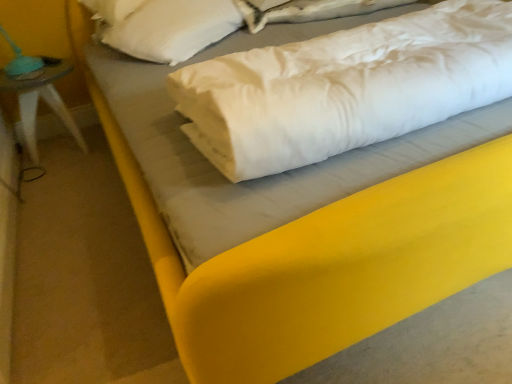
Question: Considering the relative sizes of white satin sheet at upper center and teal fabric lampshade at left in the image provided, is white satin sheet at upper center shorter than teal fabric lampshade at left?

Choices:
 (A) no
 (B) yes

Answer: (B)

Question: From a real-world perspective, is white satin sheet at upper center on teal fabric lampshade at left?

Choices:
 (A) no
 (B) yes

Answer: (B)

Question: Considering the relative sizes of white satin sheet at upper center and teal fabric lampshade at left in the image provided, is white satin sheet at upper center taller than teal fabric lampshade at left?

Choices:
 (A) no
 (B) yes

Answer: (A)

Question: Does white satin sheet at upper center have a larger size compared to teal fabric lampshade at left?

Choices:
 (A) yes
 (B) no

Answer: (B)

Question: Is white satin sheet at upper center smaller than teal fabric lampshade at left?

Choices:
 (A) yes
 (B) no

Answer: (A)

Question: Is white soft pillow at upper left in front of or behind white satin sheet at upper center in the image?

Choices:
 (A) behind
 (B) front

Answer: (B)

Question: Is white soft pillow at upper left spatially inside white satin sheet at upper center, or outside of it?

Choices:
 (A) inside
 (B) outside

Answer: (B)

Question: Considering the positions of white soft pillow at upper left and white satin sheet at upper center in the image, is white soft pillow at upper left taller or shorter than white satin sheet at upper center?

Choices:
 (A) tall
 (B) short

Answer: (A)

Question: Is white soft pillow at upper left to the left or to the right of white satin sheet at upper center in the image?

Choices:
 (A) left
 (B) right

Answer: (A)

Question: From a real-world perspective, is white satin sheet at upper center positioned above or below white soft pillow at center?

Choices:
 (A) below
 (B) above

Answer: (A)

Question: Looking at their shapes, would you say white satin sheet at upper center is wider or thinner than white soft pillow at center?

Choices:
 (A) thin
 (B) wide

Answer: (A)

Question: Based on their positions, is white satin sheet at upper center located to the left or right of white soft pillow at center?

Choices:
 (A) right
 (B) left

Answer: (A)

Question: From the image's perspective, is white satin sheet at upper center above or below white soft pillow at center?

Choices:
 (A) below
 (B) above

Answer: (B)

Question: Considering their positions, is white soft pillow at center located in front of or behind teal fabric lampshade at left?

Choices:
 (A) front
 (B) behind

Answer: (A)

Question: Do you think white soft pillow at center is within teal fabric lampshade at left, or outside of it?

Choices:
 (A) outside
 (B) inside

Answer: (A)